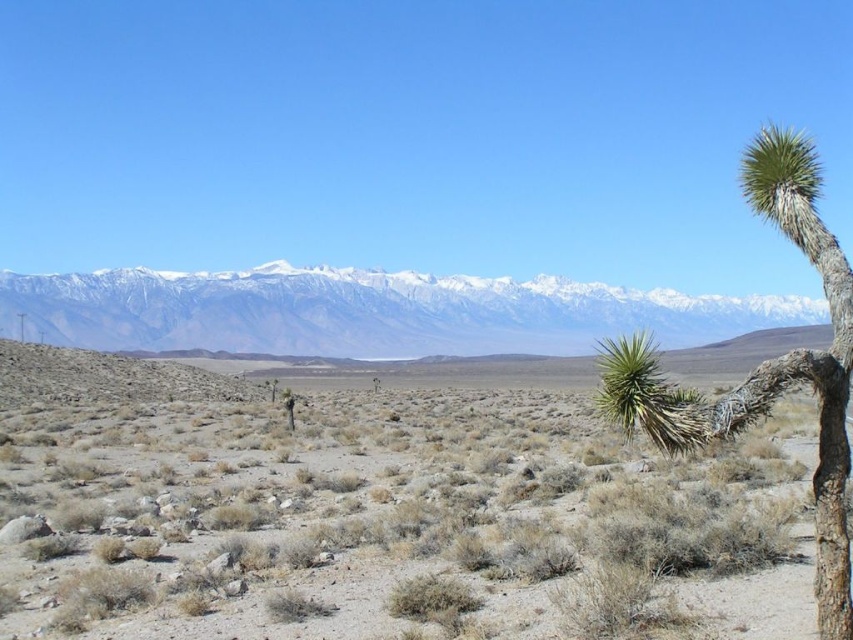
You are standing in the desert and see the brown dry grass at center and the snowy white mountain range at upper center. Which object is taller?

The brown dry grass at center is shorter than the snowy white mountain range at upper center, so the snowy white mountain range at upper center is taller.

Consider the image. You are a desert explorer who needs to find shade. You see the brown dry grass at center and the green spiky tree at right. Which object is more likely to provide shade?

The green spiky tree at right is more likely to provide shade because it is taller than the brown dry grass at center.